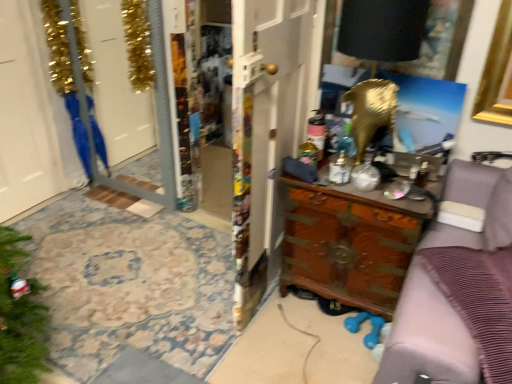
Describe the element at coordinates (448, 286) in the screenshot. The height and width of the screenshot is (384, 512). I see `brown wood dresser at right` at that location.

At what (x,y) coordinates should I click in order to perform the action: click on wooden carved dresser at center. Please return your answer as a coordinate pair (x, y). The height and width of the screenshot is (384, 512). Looking at the image, I should click on (350, 243).

This screenshot has height=384, width=512. Describe the element at coordinates (382, 30) in the screenshot. I see `black matte lamp at upper right` at that location.

I want to click on white glossy door at left, which is the 2th door from right to left, so click(x=29, y=114).

The height and width of the screenshot is (384, 512). Find the location of `brown wood dresser at right`. brown wood dresser at right is located at coordinates (448, 286).

Does wooden carved dresser at center contain clear glass screen door at left?

No, clear glass screen door at left is not a part of wooden carved dresser at center.

Between wooden carved dresser at center and clear glass screen door at left, which one has smaller width?

Thinner between the two is clear glass screen door at left.

Identify the location of screen door behind the wooden carved dresser at center. (156, 118).

From the image's perspective, between wooden carved dresser at center and clear glass screen door at left, which one is located above?

clear glass screen door at left is shown above in the image.

Is blue fabric robe at left thinner than clear glass screen door at left?

No, blue fabric robe at left is not thinner than clear glass screen door at left.

I want to click on robe on the left of clear glass screen door at left, so click(78, 131).

Are blue fabric robe at left and clear glass screen door at left beside each other?

No, blue fabric robe at left is not beside clear glass screen door at left.

Is point (271, 214) more distant than point (445, 341)?

Yes, it is behind point (445, 341).

Locate an element on the screen. This screenshot has width=512, height=384. the 1st door behind the brown wood dresser at right, counting from the anchor's position is located at coordinates (266, 129).

From the image's perspective, does wooden door at center, the 1th door in the right-to-left sequence, appear lower than brown wood dresser at right?

No.

Which of these two, wooden door at center, which is counted as the 2th door, starting from the left, or brown wood dresser at right, is thinner?

wooden door at center, which is counted as the 2th door, starting from the left, is thinner.

In terms of size, does blue fabric robe at left appear bigger or smaller than brown wood dresser at right?

Clearly, blue fabric robe at left is smaller in size than brown wood dresser at right.

Which is behind, point (92, 124) or point (482, 213)?

Point (92, 124)

From the image's perspective, which is below, blue fabric robe at left or brown wood dresser at right?

brown wood dresser at right.

From a real-world perspective, who is located higher, clear glass screen door at left or blue fabric robe at left?

clear glass screen door at left.

Is the surface of clear glass screen door at left in direct contact with blue fabric robe at left?

There is a gap between clear glass screen door at left and blue fabric robe at left.

Considering the sizes of clear glass screen door at left and blue fabric robe at left in the image, is clear glass screen door at left wider or thinner than blue fabric robe at left?

Considering their sizes, clear glass screen door at left looks slimmer than blue fabric robe at left.

Between wooden door at center, which is counted as the 2th door, starting from the left, and blue fabric robe at left, which one has less height?

Standing shorter between the two is blue fabric robe at left.

Does wooden door at center, the 1th door in the right-to-left sequence, have a smaller size compared to blue fabric robe at left?

Incorrect, wooden door at center, the 1th door in the right-to-left sequence, is not smaller in size than blue fabric robe at left.

From a real-world perspective, which is physically above, wooden door at center, which is counted as the 2th door, starting from the left, or blue fabric robe at left?

wooden door at center, which is counted as the 2th door, starting from the left.

Is wooden door at center, which is counted as the 2th door, starting from the left, directly adjacent to blue fabric robe at left?

No, wooden door at center, which is counted as the 2th door, starting from the left, is not beside blue fabric robe at left.

Is brown wood dresser at right thinner than wooden door at center, which is counted as the 2th door, starting from the left?

Incorrect, the width of brown wood dresser at right is not less than that of wooden door at center, which is counted as the 2th door, starting from the left.

Which point is more forward, (467, 167) or (261, 38)?

Point (261, 38)

Is brown wood dresser at right smaller than wooden door at center, which is counted as the 2th door, starting from the left?

Actually, brown wood dresser at right might be larger than wooden door at center, which is counted as the 2th door, starting from the left.

Is brown wood dresser at right to the left of wooden door at center, which is counted as the 2th door, starting from the left, from the viewer's perspective?

Incorrect, brown wood dresser at right is not on the left side of wooden door at center, which is counted as the 2th door, starting from the left.

Where is `screen door that is above the wooden carved dresser at center (from the image's perspective)`? The height and width of the screenshot is (384, 512). screen door that is above the wooden carved dresser at center (from the image's perspective) is located at coordinates (156, 118).

The height and width of the screenshot is (384, 512). What are the coordinates of `screen door in front of the blue fabric robe at left` in the screenshot? It's located at (156, 118).

Considering their positions, is wooden door at center, the 1th door in the right-to-left sequence, positioned closer to black matte lamp at upper right than wooden carved dresser at center?

Based on the image, wooden door at center, the 1th door in the right-to-left sequence, appears to be nearer to black matte lamp at upper right.

Which object lies further to the anchor point blue fabric robe at left, clear glass screen door at left or wooden carved dresser at center?

Among the two, wooden carved dresser at center is located further to blue fabric robe at left.

Considering their positions, is white glossy door at left, which is counted as the 1th door, starting from the left, positioned closer to blue fabric robe at left than brown wood dresser at right?

white glossy door at left, which is counted as the 1th door, starting from the left, lies closer to blue fabric robe at left than the other object.

Which object lies nearer to the anchor point wooden carved dresser at center, wooden door at center, which is counted as the 2th door, starting from the left, or clear glass screen door at left?

Based on the image, wooden door at center, which is counted as the 2th door, starting from the left, appears to be nearer to wooden carved dresser at center.

Estimate the real-world distances between objects in this image. Which object is further from brown wood dresser at right, blue fabric robe at left or clear glass screen door at left?

blue fabric robe at left lies further to brown wood dresser at right than the other object.

Considering their positions, is black matte lamp at upper right positioned further to blue fabric robe at left than clear glass screen door at left?

black matte lamp at upper right is positioned further to the anchor blue fabric robe at left.

Considering their positions, is white glossy door at left, which is the 2th door from right to left, positioned closer to brown wood dresser at right than clear glass screen door at left?

clear glass screen door at left.

Looking at this image, when comparing their distances from brown wood dresser at right, does white glossy door at left, which is the 2th door from right to left, or blue fabric robe at left seem further?

Among the two, white glossy door at left, which is the 2th door from right to left, is located further to brown wood dresser at right.

The image size is (512, 384). Identify the location of chest of drawers between white glossy door at left, which is counted as the 1th door, starting from the left, and brown wood dresser at right, in the horizontal direction. (350, 243).

You are a GUI agent. You are given a task and a screenshot of the screen. Output one action in this format:
    pyautogui.click(x=<x>, y=<y>)
    Task: Click on the robe situated between white glossy door at left, which is counted as the 1th door, starting from the left, and black matte lamp at upper right from left to right
    The height and width of the screenshot is (384, 512).
    Given the screenshot: What is the action you would take?
    pyautogui.click(x=78, y=131)

Find the location of `screen door located between white glossy door at left, which is counted as the 1th door, starting from the left, and black matte lamp at upper right in the left-right direction`. screen door located between white glossy door at left, which is counted as the 1th door, starting from the left, and black matte lamp at upper right in the left-right direction is located at coordinates (156, 118).

Identify the location of door situated between blue fabric robe at left and wooden carved dresser at center from left to right. Image resolution: width=512 pixels, height=384 pixels. (266, 129).